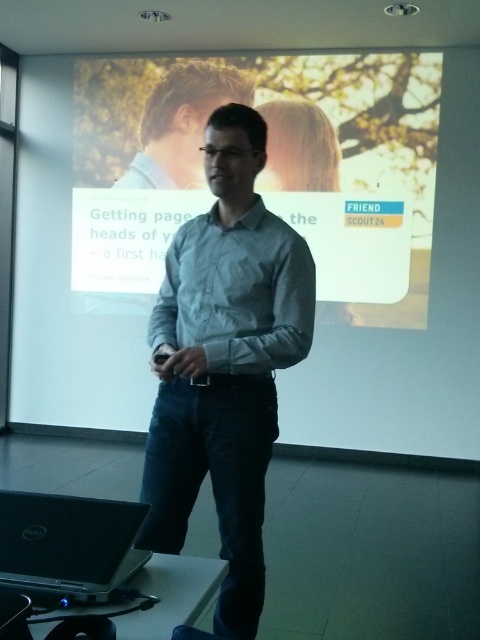
Question: Is light blue shirt at center to the right of light brown hair at center from the viewer's perspective?

Choices:
 (A) yes
 (B) no

Answer: (A)

Question: Can you confirm if light blue shirt at center is positioned below light brown hair at center?

Choices:
 (A) no
 (B) yes

Answer: (B)

Question: Which point appears closest to the camera in this image?

Choices:
 (A) (228, 170)
 (B) (176, 148)
 (C) (83, 557)

Answer: (C)

Question: Is light blue shirt at center thinner than black matte laptop at lower left?

Choices:
 (A) yes
 (B) no

Answer: (B)

Question: Which point is farther to the camera?

Choices:
 (A) (87, 577)
 (B) (226, 362)

Answer: (B)

Question: Which point is closer to the camera?

Choices:
 (A) (244, 355)
 (B) (199, 173)
 (C) (88, 531)

Answer: (C)